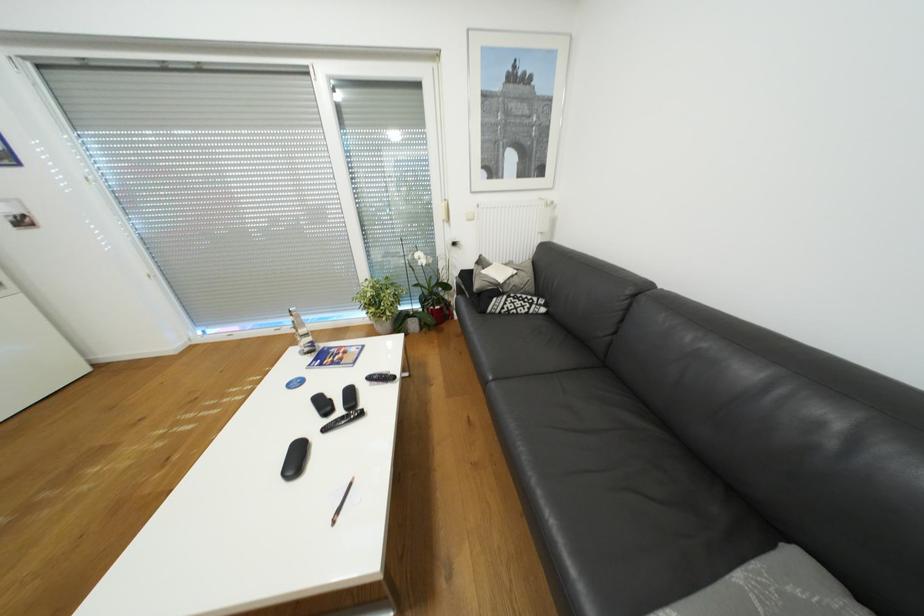
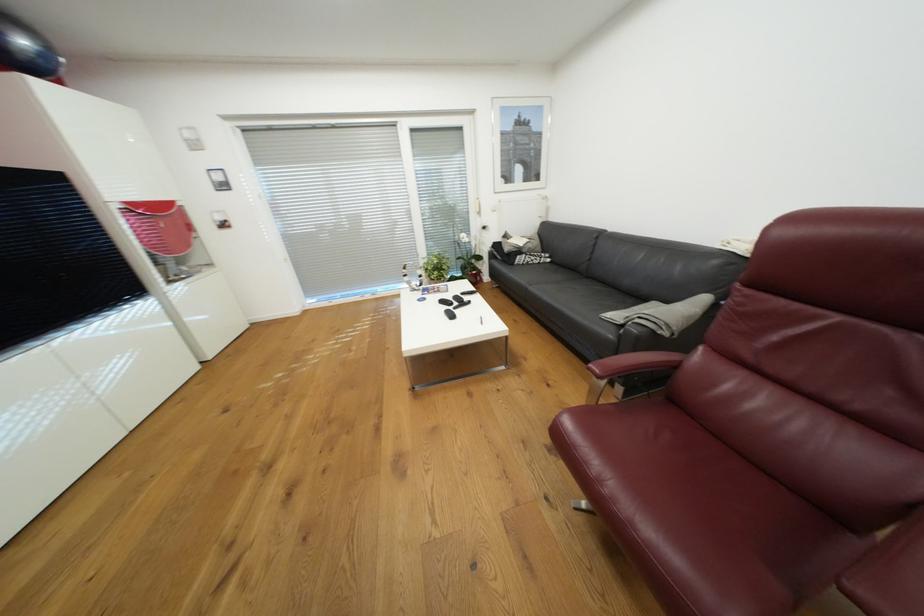
Locate, in the second image, the point that corresponds to the point at 503,291 in the first image.

(526, 252)